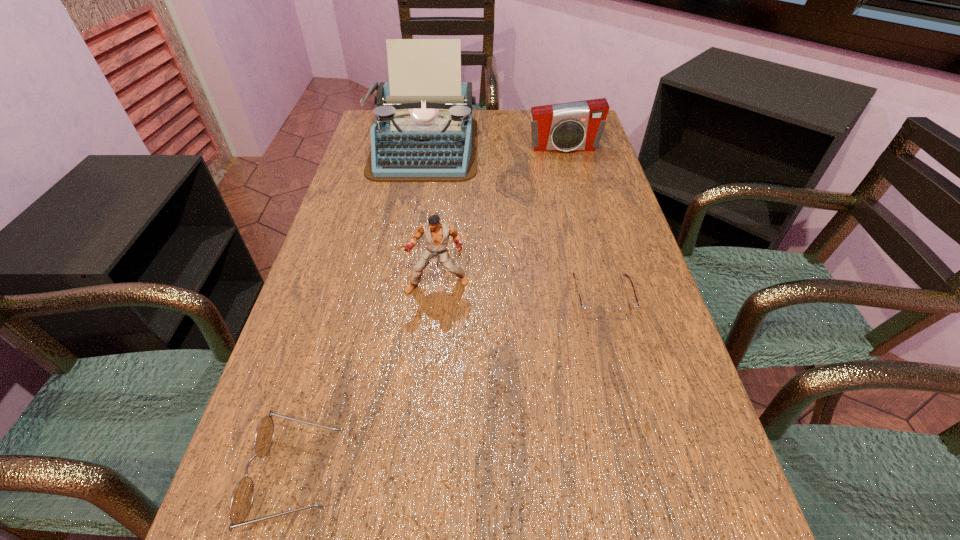
Where is `typewriter`? The width and height of the screenshot is (960, 540). typewriter is located at coordinates (424, 131).

Locate an element on the screen. The width and height of the screenshot is (960, 540). the second tallest object is located at coordinates (437, 234).

The image size is (960, 540). What are the coordinates of `the third shortest object` in the screenshot? It's located at (574, 126).

I want to click on the nearer spectacles, so click(x=242, y=498).

The width and height of the screenshot is (960, 540). Identify the location of the left spectacles. (242, 498).

Where is `the shortest object`? The width and height of the screenshot is (960, 540). the shortest object is located at coordinates (593, 313).

You are a GUI agent. You are given a task and a screenshot of the screen. Output one action in this format:
    pyautogui.click(x=<x>, y=<y>)
    Task: Click on the shorter spectacles
    This screenshot has height=540, width=960.
    Given the screenshot: What is the action you would take?
    pyautogui.click(x=593, y=313)

Find the location of `vacant region located 0.160m on the typing side of the tallest object`. vacant region located 0.160m on the typing side of the tallest object is located at coordinates (411, 217).

The height and width of the screenshot is (540, 960). In order to click on free point located on the front-facing side of the puncher in this screenshot , I will do `click(432, 339)`.

You are a GUI agent. You are given a task and a screenshot of the screen. Output one action in this format:
    pyautogui.click(x=<x>, y=<y>)
    Task: Click on the free space located 0.080m on the front-facing side of the third tallest object
    This screenshot has width=960, height=540.
    Given the screenshot: What is the action you would take?
    pyautogui.click(x=569, y=171)